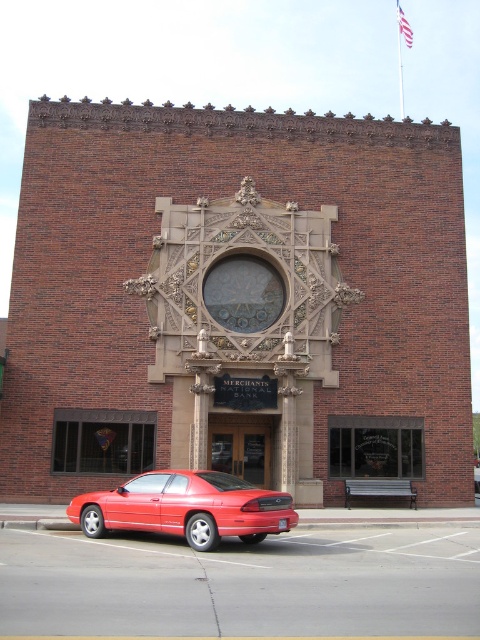
Question: Does glossy red car at lower left have a lesser width compared to metallic bench at lower center?

Choices:
 (A) yes
 (B) no

Answer: (B)

Question: Where is glossy red car at lower left located in relation to metallic bench at lower center in the image?

Choices:
 (A) below
 (B) above

Answer: (B)

Question: Which object is closer to the camera taking this photo?

Choices:
 (A) metallic bench at lower center
 (B) glossy red car at lower left

Answer: (B)

Question: Is glossy red car at lower left smaller than metallic bench at lower center?

Choices:
 (A) no
 (B) yes

Answer: (A)